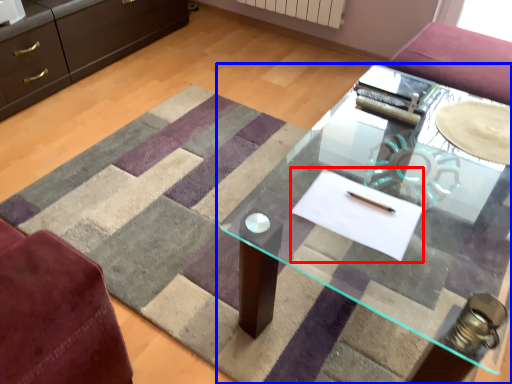
Question: Among these objects, which one is farthest to the camera, flat (highlighted by a red box) or table (highlighted by a blue box)?

Choices:
 (A) flat
 (B) table

Answer: (B)